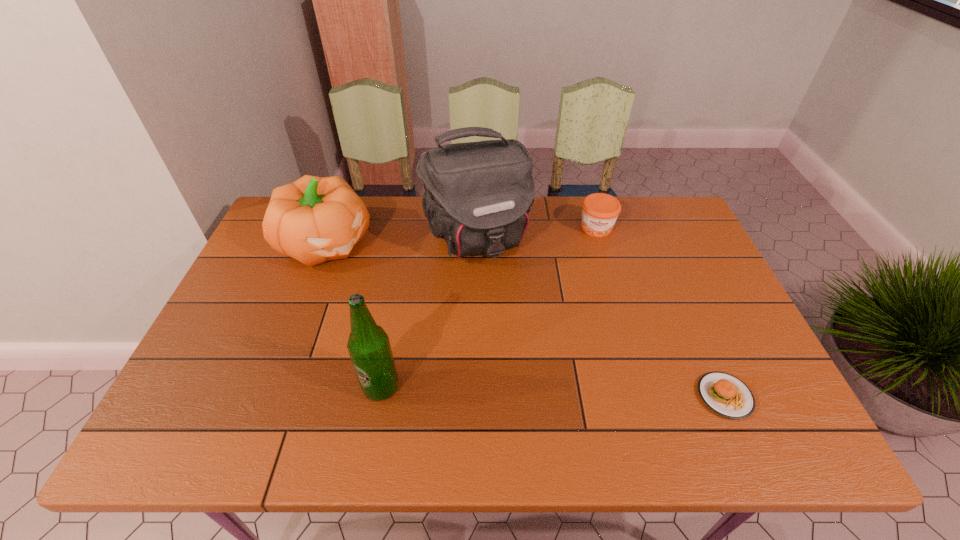
Image resolution: width=960 pixels, height=540 pixels. Identify the location of vacant spot on the desktop that is between the fourth object from right to left and the food and is positioned on the front label of the fourth object from left to right. (600, 393).

This screenshot has width=960, height=540. I want to click on free space on the desktop that is between the second object from left to right and the food and is positioned on the open flap of the third object from right to left, so click(x=549, y=392).

At what (x,y) coordinates should I click in order to perform the action: click on free space on the desktop that is between the beer bottle and the food and is positioned on the carved face of the leftmost object. Please return your answer as a coordinate pair (x, y). This screenshot has height=540, width=960. Looking at the image, I should click on (508, 391).